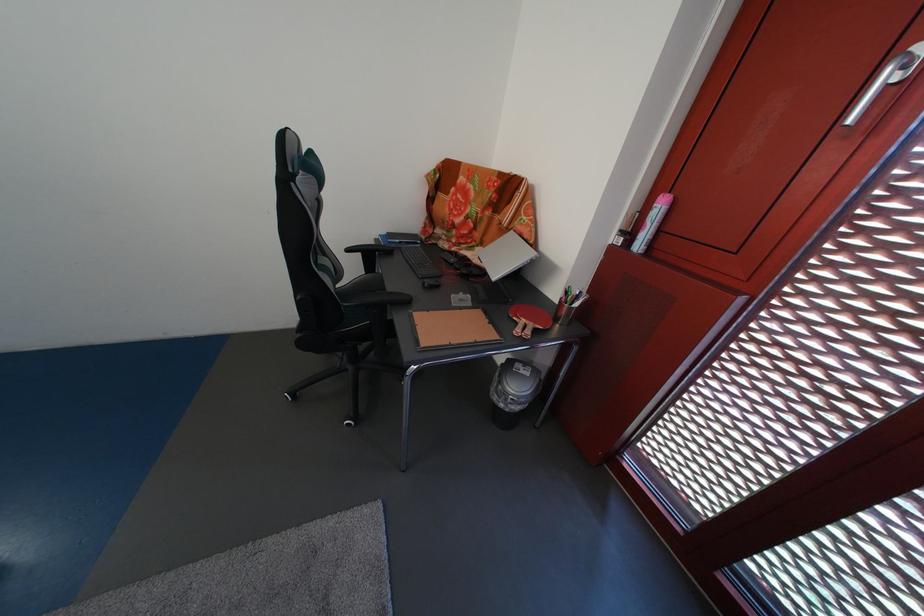
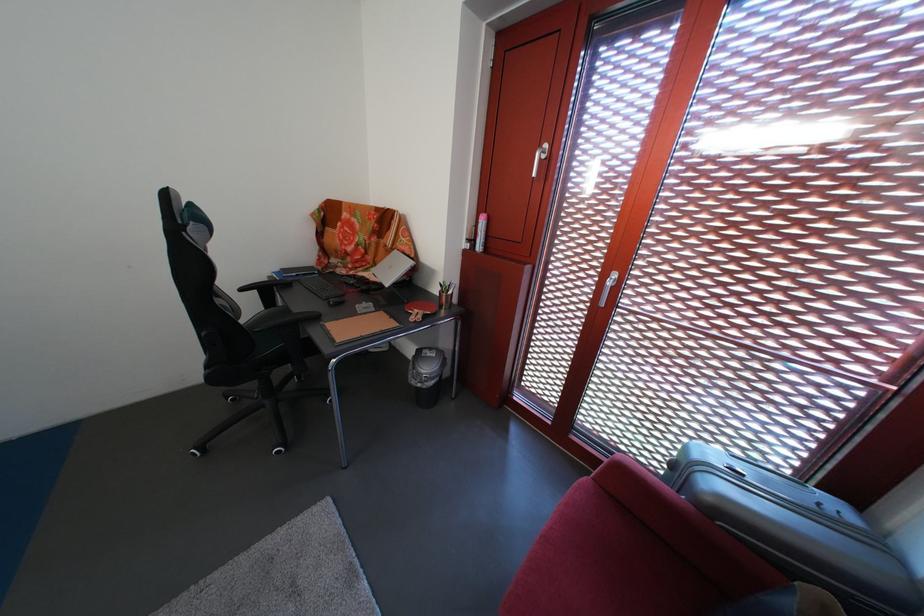
In the second image, find the point that corresponds to the point at 505,405 in the first image.

(424, 389)